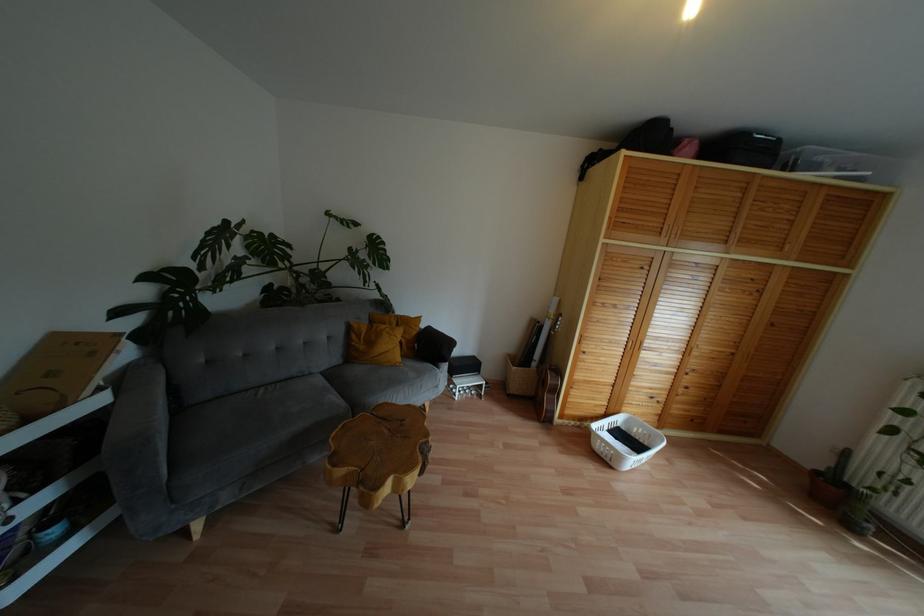
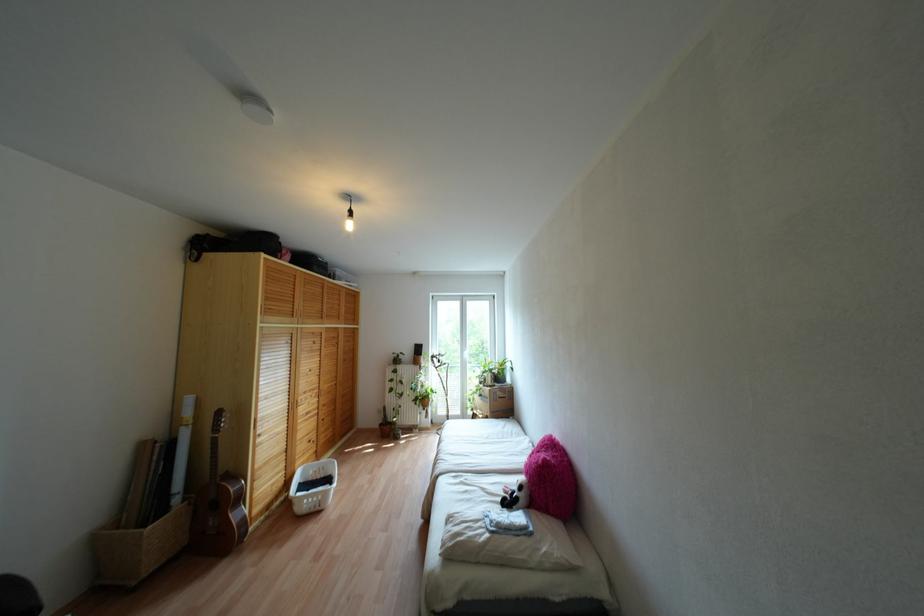
In the second image, find the point that corresponds to [554,391] in the first image.

(238, 498)